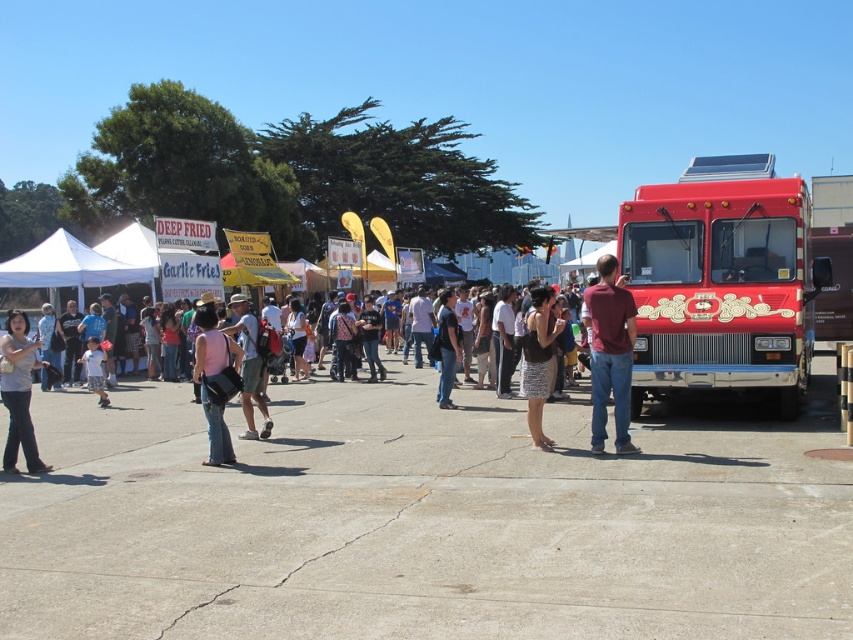
Can you confirm if maroon shirt at center is thinner than denim pants at left?

Yes.

This screenshot has height=640, width=853. Describe the element at coordinates (610, 355) in the screenshot. I see `maroon shirt at center` at that location.

Where is `maroon shirt at center`? The image size is (853, 640). maroon shirt at center is located at coordinates (610, 355).

Does maroon shirt at center have a larger size compared to black textured dress at center?

Actually, maroon shirt at center might be smaller than black textured dress at center.

Consider the image. Is maroon shirt at center above black textured dress at center?

Correct, maroon shirt at center is located above black textured dress at center.

The image size is (853, 640). What do you see at coordinates (610, 355) in the screenshot? I see `maroon shirt at center` at bounding box center [610, 355].

I want to click on maroon shirt at center, so click(610, 355).

Which is behind, point (28, 380) or point (200, 378)?

The point (200, 378) is more distant.

This screenshot has height=640, width=853. I want to click on denim pants at left, so click(x=19, y=394).

You are a GUI agent. You are given a task and a screenshot of the screen. Output one action in this format:
    pyautogui.click(x=<x>, y=<y>)
    Task: Click on the denim pants at left
    
    Given the screenshot: What is the action you would take?
    pyautogui.click(x=19, y=394)